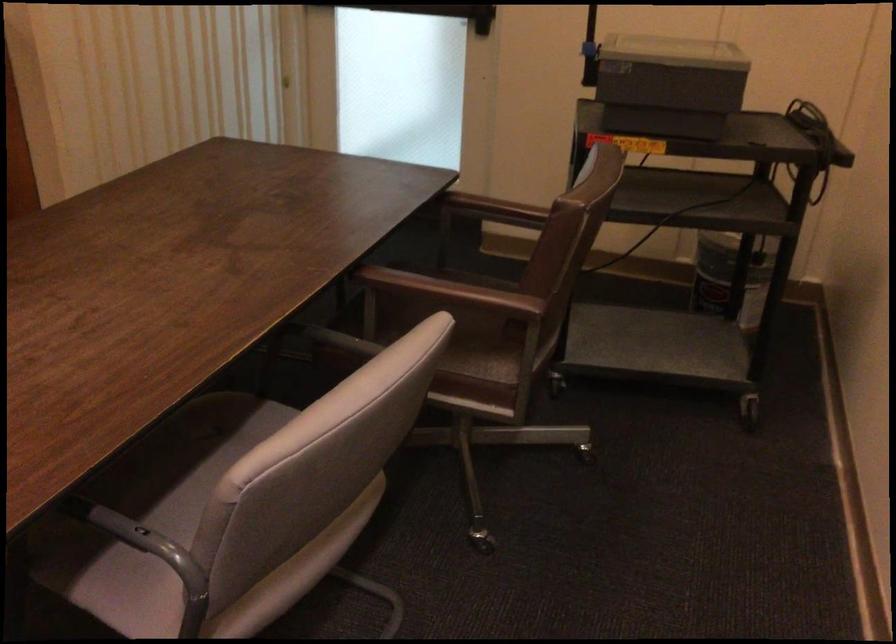
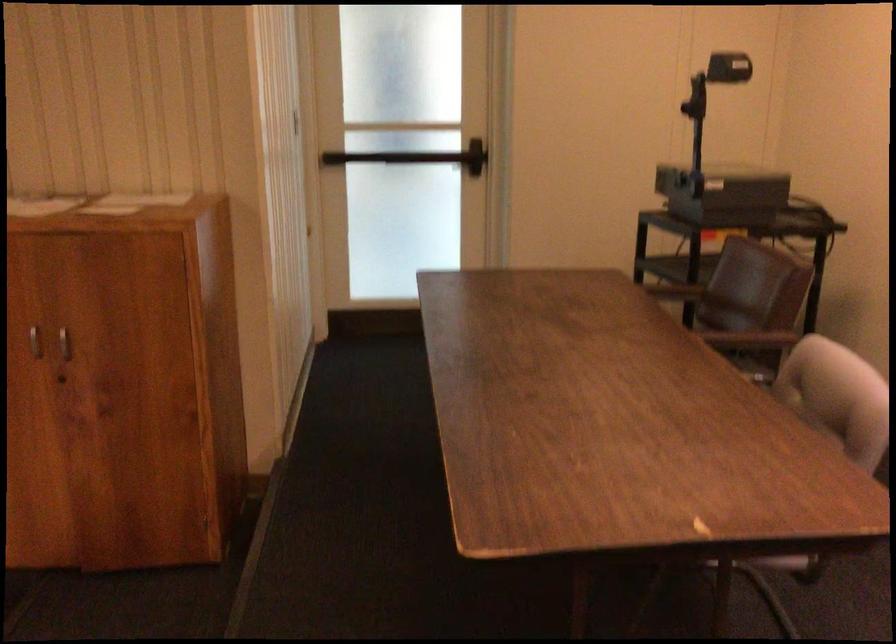
Question: In a continuous first-person perspective shot, in which direction is the camera moving?

Choices:
 (A) Left
 (B) Right
 (C) Forward
 (D) Backward

Answer: (A)